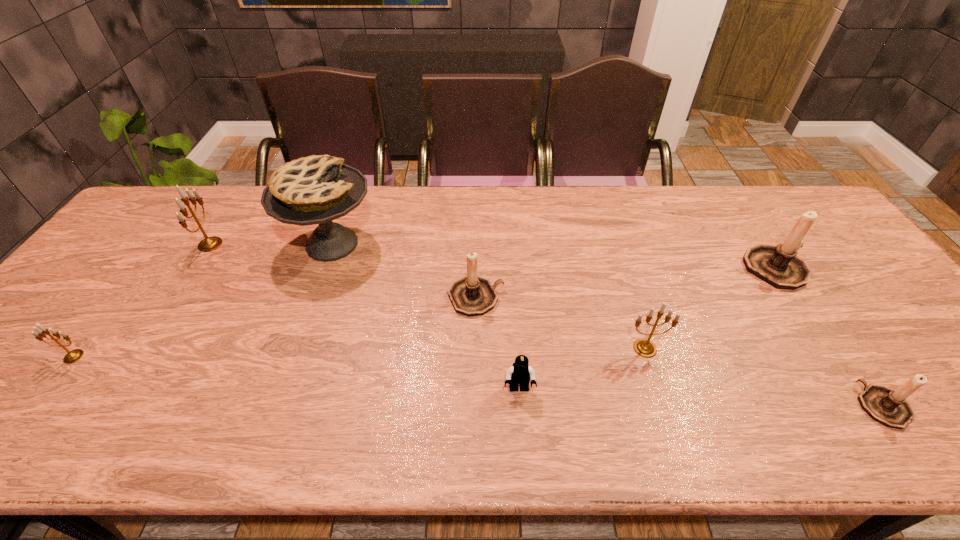
In order to click on free region that satisfies the following two spatial constraints: 1. on the front side of the nearest candelabrum; 2. on the right side of the second gold candelabrum from left to right in this screenshot , I will do `click(108, 406)`.

The image size is (960, 540). I want to click on vacant space that satisfies the following two spatial constraints: 1. on the front side of the farthest gold candelabrum; 2. on the right side of the biggest brown candle holder, so click(x=195, y=268).

Locate an element on the screen. vacant space that satisfies the following two spatial constraints: 1. on the cut side of the second biggest brown candle holder; 2. on the left side of the tallest object is located at coordinates (314, 297).

What are the coordinates of `vacant area in the image that satisfies the following two spatial constraints: 1. on the front side of the second candelabrum from left to right; 2. on the right side of the biggest brown candle holder` in the screenshot? It's located at coord(195,268).

This screenshot has width=960, height=540. I want to click on vacant point that satisfies the following two spatial constraints: 1. on the back side of the leftmost object; 2. on the right side of the leftmost brown candle holder, so click(119, 297).

The image size is (960, 540). Find the location of `blank area in the image that satisfies the following two spatial constraints: 1. on the cut side of the sixth object from right to left; 2. on the right side of the biggest brown candle holder`. blank area in the image that satisfies the following two spatial constraints: 1. on the cut side of the sixth object from right to left; 2. on the right side of the biggest brown candle holder is located at coordinates (324, 268).

Where is `vacant region that satisfies the following two spatial constraints: 1. on the back side of the leftmost brown candle holder; 2. on the cut side of the sixth object from right to left`? vacant region that satisfies the following two spatial constraints: 1. on the back side of the leftmost brown candle holder; 2. on the cut side of the sixth object from right to left is located at coordinates (476, 244).

Identify the location of vacant region that satisfies the following two spatial constraints: 1. on the cut side of the third object from left to right; 2. on the left side of the second smallest gold candelabrum. (296, 348).